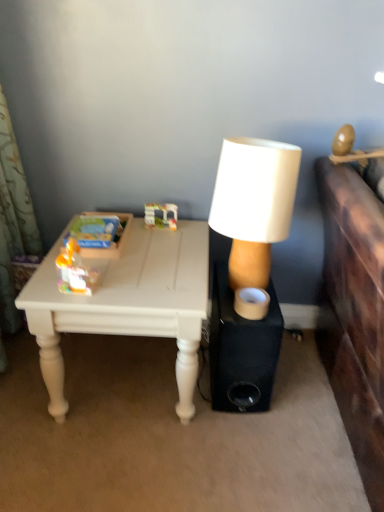
Question: Which direction should I rotate to face translucent plastic toy at center, arranged as the 1th toy when viewed from the top, — up or down?

Choices:
 (A) up
 (B) down

Answer: (A)

Question: From the image's perspective, is translucent plastic toy at center, which is the first toy in back-to-front order, above white painted wood table at lower left?

Choices:
 (A) yes
 (B) no

Answer: (A)

Question: Considering the relative sizes of translucent plastic toy at center, marked as the 2th toy in a front-to-back arrangement, and white painted wood table at lower left in the image provided, is translucent plastic toy at center, marked as the 2th toy in a front-to-back arrangement, shorter than white painted wood table at lower left?

Choices:
 (A) yes
 (B) no

Answer: (A)

Question: From the image's perspective, is translucent plastic toy at center, arranged as the first toy when viewed from the right, beneath white painted wood table at lower left?

Choices:
 (A) no
 (B) yes

Answer: (A)

Question: From a real-world perspective, is translucent plastic toy at center, marked as the 2th toy in a front-to-back arrangement, on top of white painted wood table at lower left?

Choices:
 (A) yes
 (B) no

Answer: (A)

Question: Does translucent plastic toy at center, arranged as the 1th toy when viewed from the top, have a lesser width compared to white painted wood table at lower left?

Choices:
 (A) no
 (B) yes

Answer: (B)

Question: Does translucent plastic toy at center, the 2th toy in the bottom-to-top sequence, lie behind white painted wood table at lower left?

Choices:
 (A) yes
 (B) no

Answer: (A)

Question: Can you confirm if black matte speaker at center is smaller than matte plastic toy at left, the first toy in the left-to-right sequence?

Choices:
 (A) yes
 (B) no

Answer: (B)

Question: Is black matte speaker at center further to camera compared to matte plastic toy at left, marked as the 2th toy in a top-to-bottom arrangement?

Choices:
 (A) yes
 (B) no

Answer: (A)

Question: From a real-world perspective, is black matte speaker at center positioned under matte plastic toy at left, marked as the first toy in a front-to-back arrangement, based on gravity?

Choices:
 (A) no
 (B) yes

Answer: (B)

Question: Does black matte speaker at center have a lesser height compared to matte plastic toy at left, placed as the 1th toy when sorted from bottom to top?

Choices:
 (A) yes
 (B) no

Answer: (B)

Question: From the image's perspective, is black matte speaker at center under matte plastic toy at left, marked as the first toy in a front-to-back arrangement?

Choices:
 (A) no
 (B) yes

Answer: (B)

Question: From the image's perspective, is black matte speaker at center over matte plastic toy at left, marked as the 2th toy in a top-to-bottom arrangement?

Choices:
 (A) no
 (B) yes

Answer: (A)

Question: Is translucent plastic toy at center, arranged as the 1th toy when viewed from the top, in front of white matte lamp at center?

Choices:
 (A) no
 (B) yes

Answer: (A)